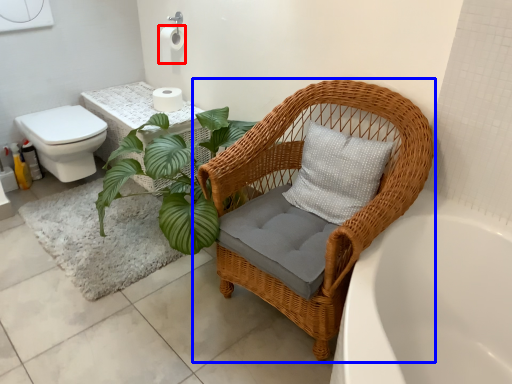
Question: Which point is closer to the camera, toilet paper (highlighted by a red box) or chair (highlighted by a blue box)?

Choices:
 (A) toilet paper
 (B) chair

Answer: (B)